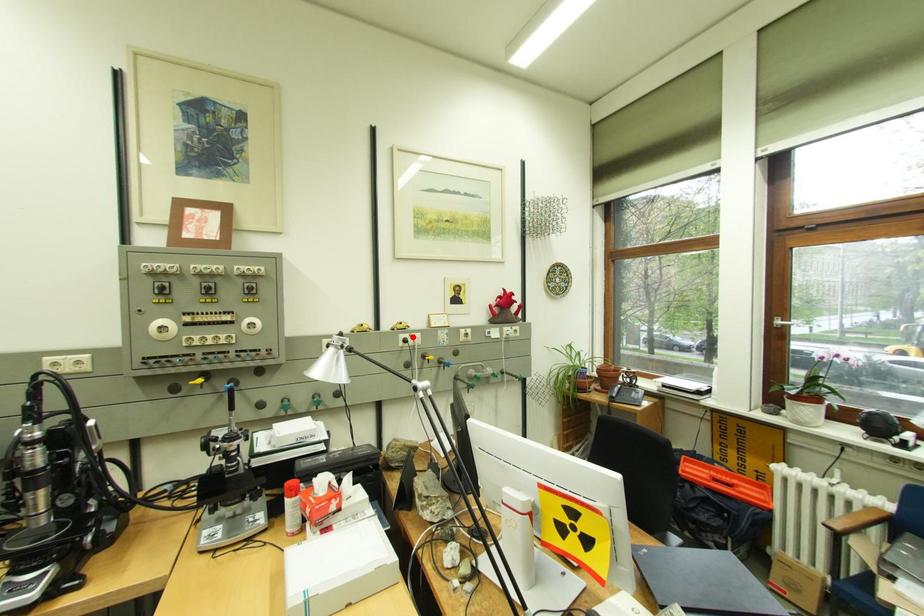
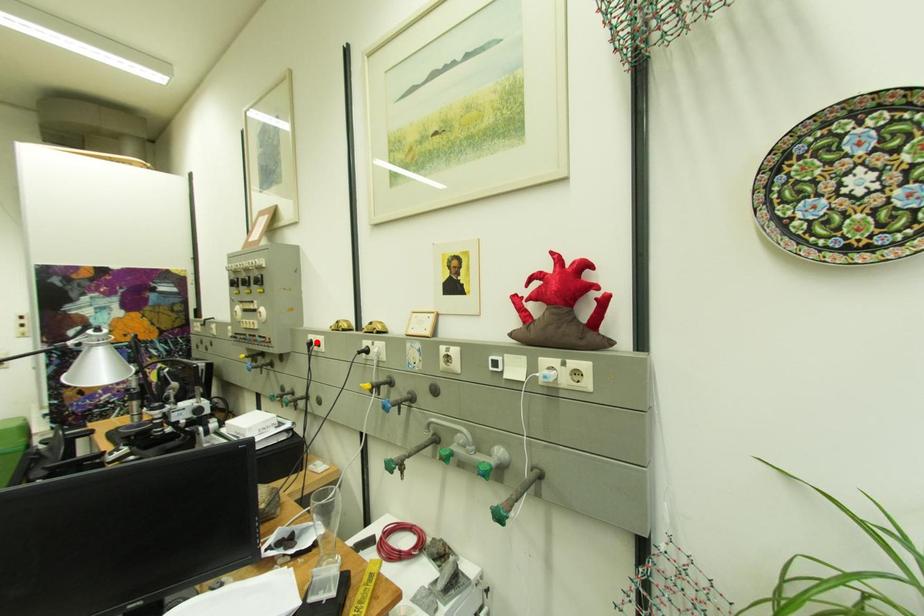
I am providing you with two images of the same scene from different viewpoints. A red point is marked on the first image and another point is marked on the second image. Do the highlighted points in image1 and image2 indicate the same real-world spot?

No